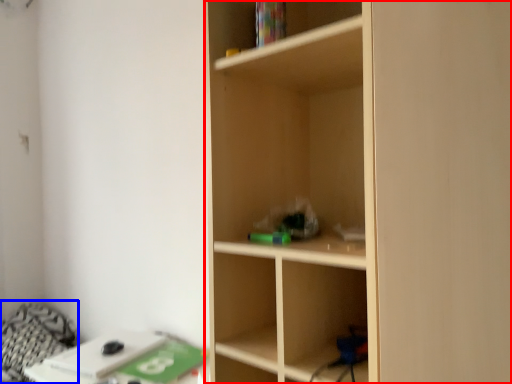
Question: Among these objects, which one is farthest to the camera, shelf (highlighted by a red box) or bedding (highlighted by a blue box)?

Choices:
 (A) shelf
 (B) bedding

Answer: (B)